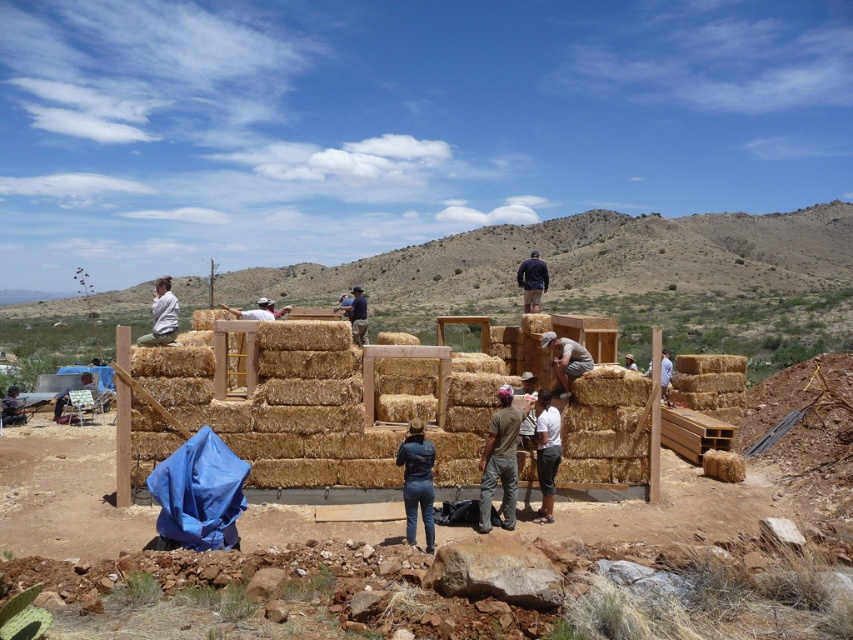
In the scene shown: You are a drone operator tasked with capturing aerial footage of the construction site. You need to ensure the camera focuses on the dark gray fabric pants at lower center. According to the coordinates provided, where should you position the camera to capture this subject?

The dark gray fabric pants at lower center is located at coordinates point [546,452], so the camera should be positioned to focus on that exact point to capture the subject.

You are a worker at the construction site. You need to place a tool on the ground near the dark blue jeans at center and the brown straw bale at center. Where should you place it so it stays close to both objects?

The tool should be placed on the ground below the brown straw bale at center, near the dark blue jeans at center since the dark blue jeans at center is located below the brown straw bale at center.

Based on the photo, you are standing at the center of the construction site and notice a point marked at coordinates (546, 452). What object is located at that point?

The point at coordinates (546, 452) indicates the location of the dark gray fabric pants at lower center.